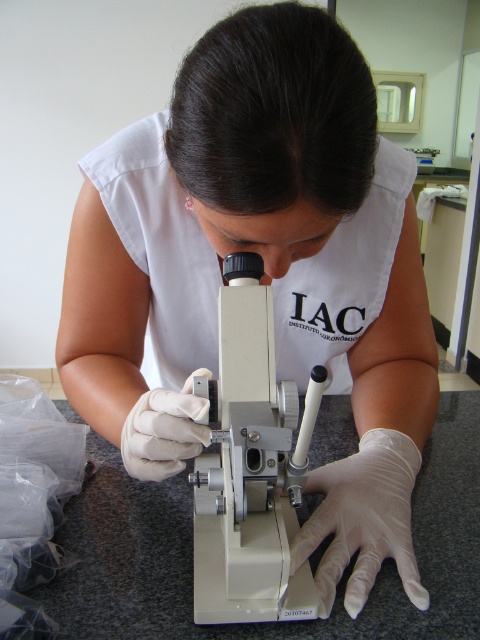
Question: Does white plastic microscope at center appear over white smooth glove at center?

Choices:
 (A) no
 (B) yes

Answer: (A)

Question: Which point is closer to the camera?

Choices:
 (A) (170, 413)
 (B) (271, 420)
 (C) (397, 422)

Answer: (B)

Question: Considering the relative positions of white latex glove at center and white smooth glove at center in the image provided, where is white latex glove at center located with respect to white smooth glove at center?

Choices:
 (A) below
 (B) above

Answer: (A)

Question: Which object is farther from the camera taking this photo?

Choices:
 (A) white plastic microscope at center
 (B) white smooth glove at center

Answer: (B)

Question: Estimate the real-world distances between objects in this image. Which object is farther from the white latex glove at center?

Choices:
 (A) white plastic microscope at center
 (B) white smooth glove at center

Answer: (B)

Question: Can you confirm if white plastic microscope at center is positioned above white latex glove at center?

Choices:
 (A) yes
 (B) no

Answer: (A)